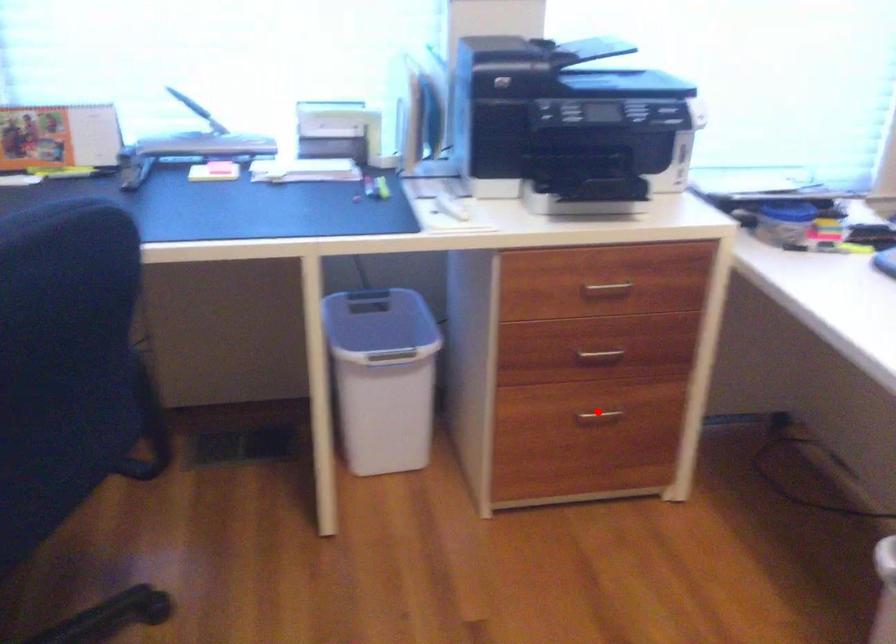
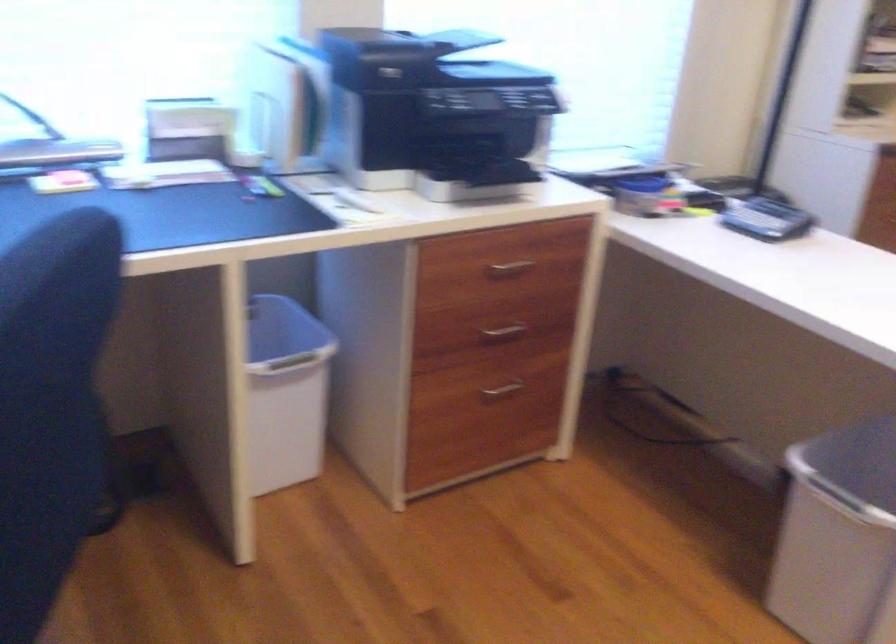
The point at the highlighted location is marked in the first image. Where is the corresponding point in the second image?

(501, 388)